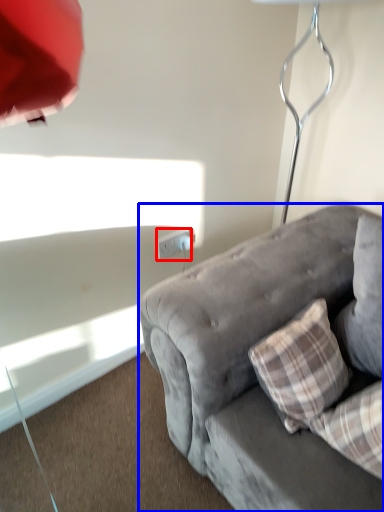
Question: Which object is closer to the camera taking this photo, power outlet (highlighted by a red box) or studio couch (highlighted by a blue box)?

Choices:
 (A) power outlet
 (B) studio couch

Answer: (B)